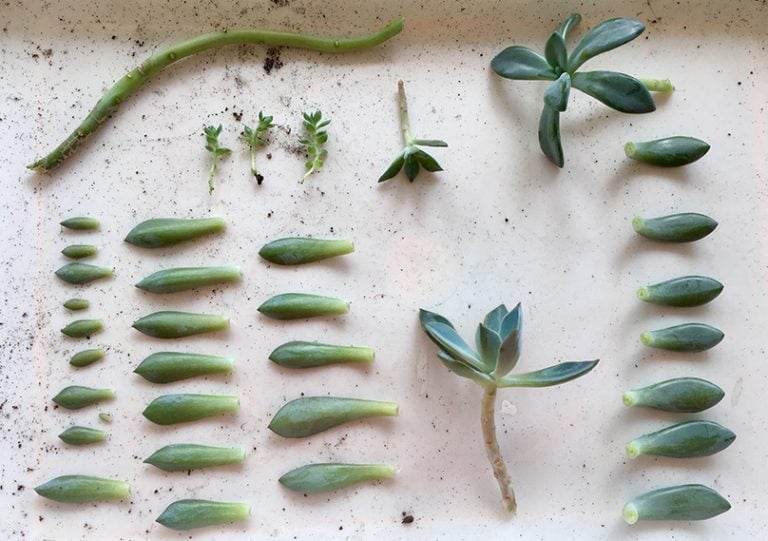
The image size is (768, 541). In order to click on large plant in this screenshot , I will do `click(497, 372)`.